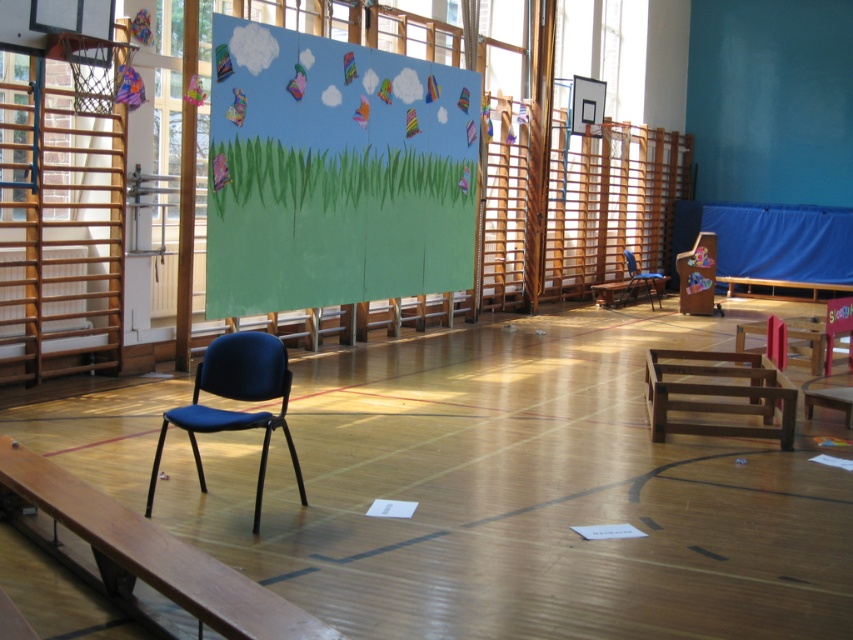
Between point (791, 288) and point (622, 291), which one is positioned in front?

Point (622, 291)

Does brown wooden bench at right have a smaller size compared to blue plastic chair at center?

Incorrect, brown wooden bench at right is not smaller in size than blue plastic chair at center.

Where is `brown wooden bench at right`? brown wooden bench at right is located at coordinates (782, 289).

Is blue fabric chair at left thinner than brown wooden bench at right?

Indeed, blue fabric chair at left has a lesser width compared to brown wooden bench at right.

Can you confirm if blue fabric chair at left is positioned above brown wooden bench at right?

No.

Measure the distance between point (192, 413) and camera.

The distance of point (192, 413) from camera is 19.47 feet.

Identify the location of blue fabric chair at left. (235, 400).

Can you confirm if brown wooden bench at center is taller than blue fabric chair at left?

No.

Is brown wooden bench at center to the right of blue fabric chair at left from the viewer's perspective?

Correct, you'll find brown wooden bench at center to the right of blue fabric chair at left.

Locate an element on the screen. brown wooden bench at center is located at coordinates (718, 394).